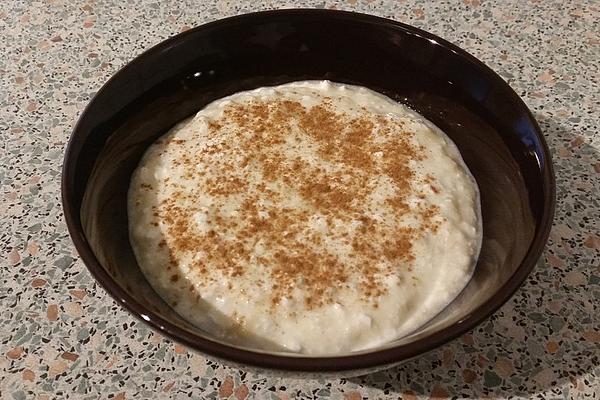
The image size is (600, 400). What are the coordinates of `bowl` in the screenshot? It's located at (533, 165).